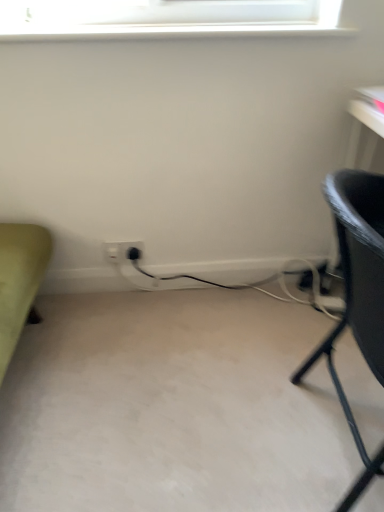
Question: Is black textured chair at right in front of or behind white plastic electric outlet at lower center, the 2th electric outlet positioned from the left, in the image?

Choices:
 (A) behind
 (B) front

Answer: (B)

Question: From their relative heights in the image, would you say black textured chair at right is taller or shorter than white plastic electric outlet at lower center, positioned as the first electric outlet in right-to-left order?

Choices:
 (A) short
 (B) tall

Answer: (B)

Question: Based on their relative distances, which object is nearer to the white plastic electric outlet at lower center, positioned as the first electric outlet in right-to-left order?

Choices:
 (A) black plastic plug at lower center
 (B) black textured chair at right
 (C) white plastic electric outlet at center, arranged as the 2th electric outlet when viewed from the right

Answer: (C)

Question: Which is nearer to the white plastic electric outlet at center, which is the 1th electric outlet from left to right?

Choices:
 (A) black textured chair at right
 (B) white plastic electric outlet at lower center, positioned as the first electric outlet in right-to-left order
 (C) black plastic plug at lower center

Answer: (B)